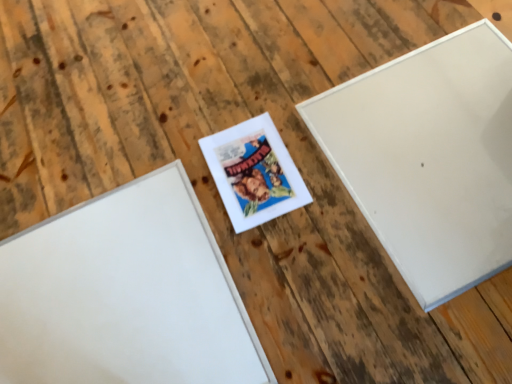
This screenshot has width=512, height=384. Identify the location of free space between matte white picture frame at center, positioned as the second picture frame in right-to-left order, and white matte picture frame at center, which appears as the 1th picture frame when viewed from the left. coord(237,242).